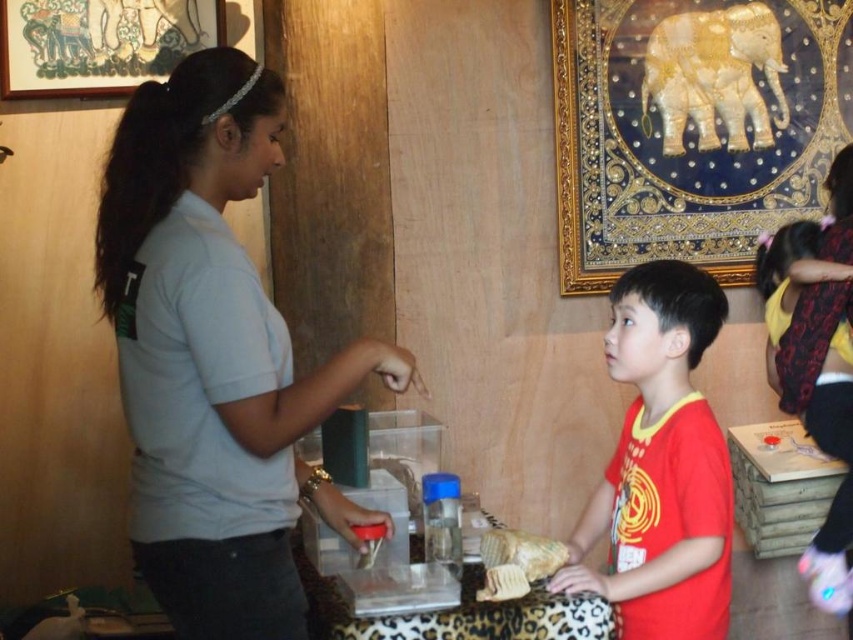
Question: Which of the following is the closest to the observer?

Choices:
 (A) light gray shirt at center
 (B) golden textured bread at lower center

Answer: (A)

Question: Which point is closer to the camera?

Choices:
 (A) (252, 372)
 (B) (633, 625)

Answer: (A)

Question: Is red matte shirt at center thinner than golden textured bread at lower center?

Choices:
 (A) no
 (B) yes

Answer: (A)

Question: Does light gray shirt at center appear on the left side of golden textured bread at lower center?

Choices:
 (A) no
 (B) yes

Answer: (B)

Question: Which point is farther to the camera?

Choices:
 (A) golden textured bread at lower center
 (B) red matte shirt at center

Answer: (B)

Question: Is light gray shirt at center to the right of red matte shirt at center from the viewer's perspective?

Choices:
 (A) no
 (B) yes

Answer: (A)